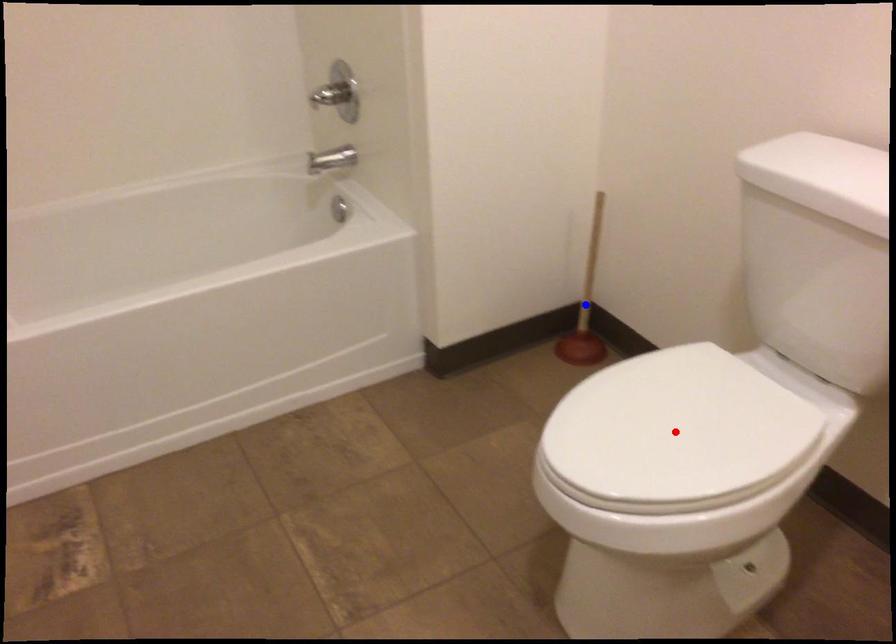
Question: Which of the two points in the image is closer to the camera?

Choices:
 (A) Blue point is closer.
 (B) Red point is closer.

Answer: (B)